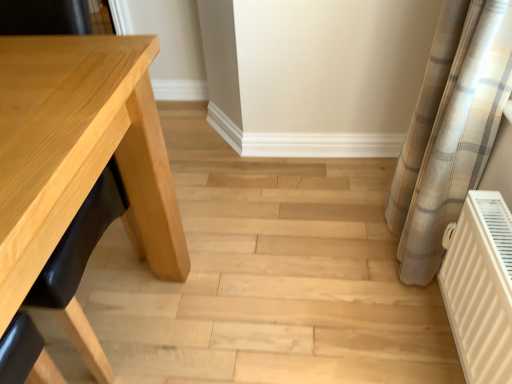
Where is `vacant space behind plaid fabric curtain at right`? vacant space behind plaid fabric curtain at right is located at coordinates (358, 202).